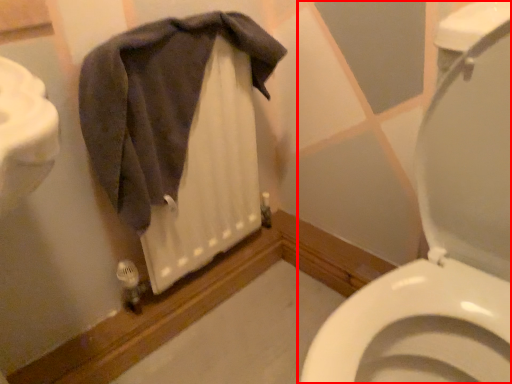
Question: From the image's perspective, considering the relative positions of toilet (annotated by the red box) and bath towel in the image provided, where is toilet (annotated by the red box) located with respect to the staircase?

Choices:
 (A) below
 (B) above

Answer: (A)